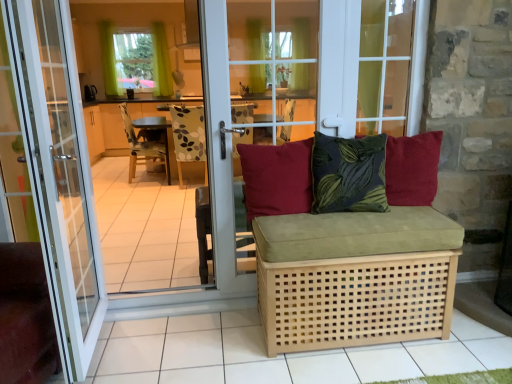
Where is `vacant area on top of light brown woven studio couch at center (from a real-world perspective)`? The width and height of the screenshot is (512, 384). vacant area on top of light brown woven studio couch at center (from a real-world perspective) is located at coordinates (326, 215).